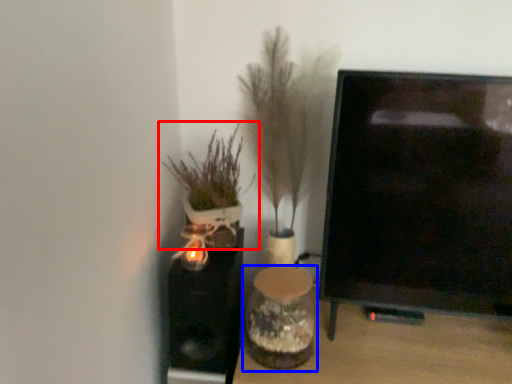
Question: Among these objects, which one is nearest to the camera, houseplant (highlighted by a red box) or vase (highlighted by a blue box)?

Choices:
 (A) houseplant
 (B) vase

Answer: (B)